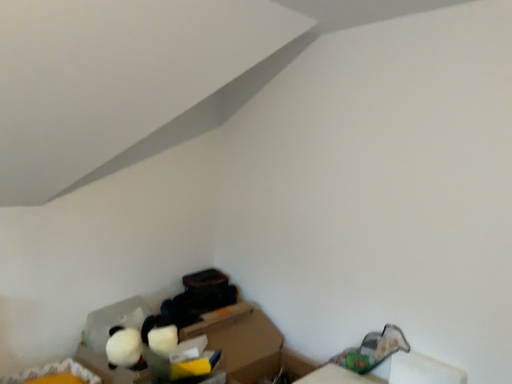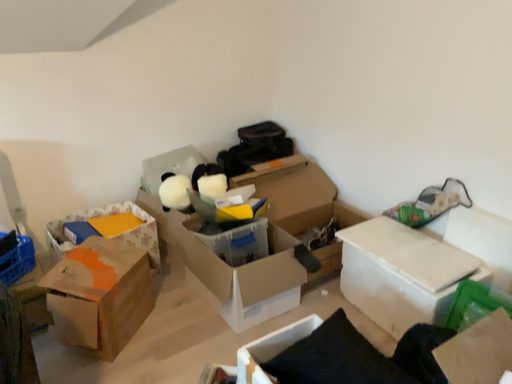
Question: Which way did the camera rotate in the video?

Choices:
 (A) rotated left
 (B) rotated right

Answer: (A)